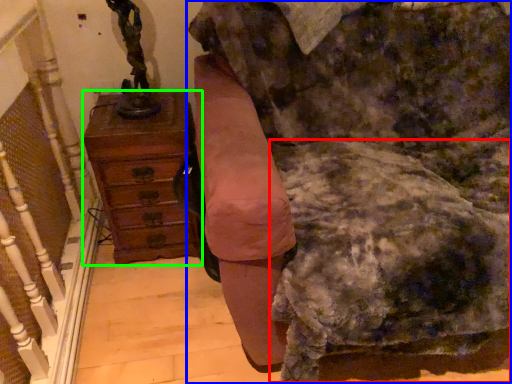
Question: Estimate the real-world distances between objects in this image. Which object is closer to swivel chair (highlighted by a red box), furniture (highlighted by a blue box) or chest of drawers (highlighted by a green box)?

Choices:
 (A) furniture
 (B) chest of drawers

Answer: (A)